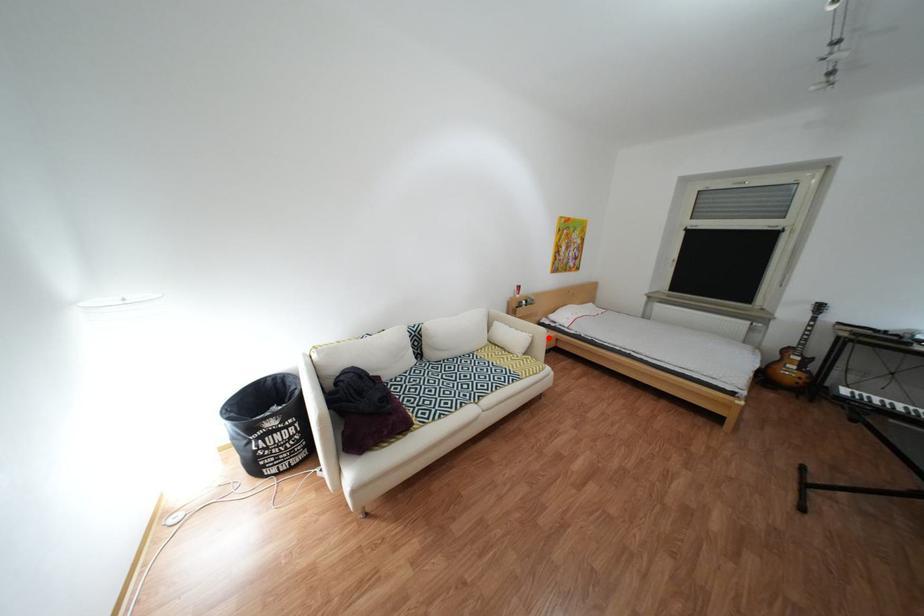
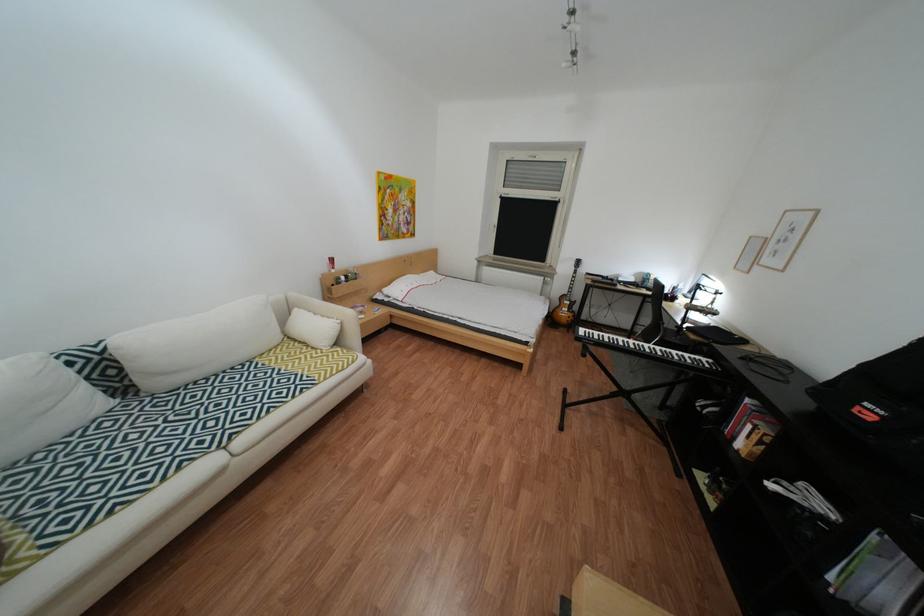
Question: I am providing you with two images of the same scene from different viewpoints. A red point is shown in image1. For the corresponding object point in image2, is it positioned nearer or farther from the camera?

Choices:
 (A) Nearer
 (B) Farther

Answer: (A)